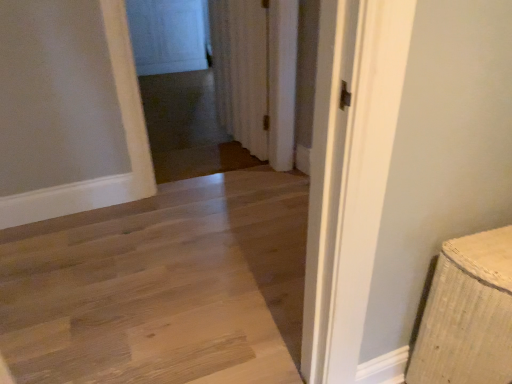
Question: From a real-world perspective, is transparent glass screen door at upper center located higher than white textured curtain at center?

Choices:
 (A) no
 (B) yes

Answer: (A)

Question: Is transparent glass screen door at upper center positioned in front of white textured curtain at center?

Choices:
 (A) yes
 (B) no

Answer: (B)

Question: Can you confirm if transparent glass screen door at upper center is smaller than white textured curtain at center?

Choices:
 (A) no
 (B) yes

Answer: (B)

Question: Is transparent glass screen door at upper center touching white textured curtain at center?

Choices:
 (A) yes
 (B) no

Answer: (B)

Question: Is transparent glass screen door at upper center looking in the opposite direction of white textured curtain at center?

Choices:
 (A) no
 (B) yes

Answer: (A)

Question: Does transparent glass screen door at upper center come behind white textured curtain at center?

Choices:
 (A) no
 (B) yes

Answer: (B)

Question: Is white textured curtain at center looking in the opposite direction of transparent glass screen door at upper center?

Choices:
 (A) no
 (B) yes

Answer: (A)

Question: Does white textured curtain at center turn towards transparent glass screen door at upper center?

Choices:
 (A) no
 (B) yes

Answer: (A)

Question: Can you confirm if white textured curtain at center is wider than transparent glass screen door at upper center?

Choices:
 (A) yes
 (B) no

Answer: (A)

Question: Is white textured curtain at center smaller than transparent glass screen door at upper center?

Choices:
 (A) no
 (B) yes

Answer: (A)

Question: From a real-world perspective, is white textured curtain at center positioned under transparent glass screen door at upper center based on gravity?

Choices:
 (A) yes
 (B) no

Answer: (B)

Question: Can you confirm if white textured curtain at center is positioned to the right of transparent glass screen door at upper center?

Choices:
 (A) yes
 (B) no

Answer: (A)

Question: Is natural wood floor at center positioned with its back to transparent glass screen door at upper center?

Choices:
 (A) no
 (B) yes

Answer: (A)